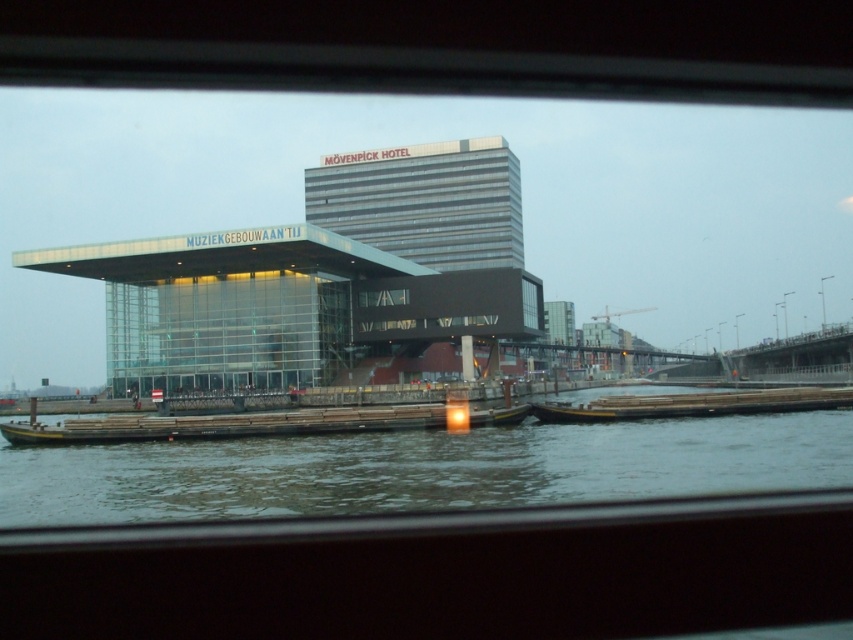
You are standing on the boat and want to point out the exact location of the greenish water at lower center. What are the coordinates where you should point?

The greenish water at lower center is located at coordinates point (422, 468).